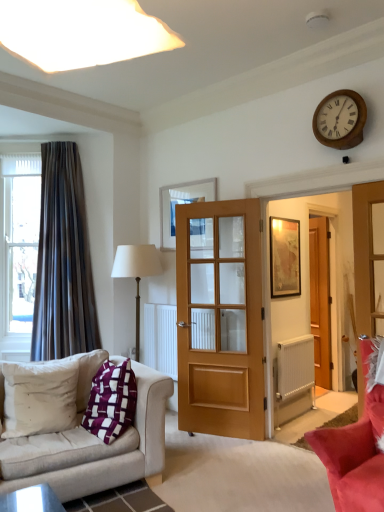
Question: Is wooden door at center, which is the second door from left to right, to the left of matte gold picture frame at center-right, which is the 1th picture frame from right to left, from the viewer's perspective?

Choices:
 (A) yes
 (B) no

Answer: (B)

Question: Is wooden door at center, which is the second door from left to right, smaller than matte gold picture frame at center-right, which is the 1th picture frame from right to left?

Choices:
 (A) no
 (B) yes

Answer: (A)

Question: Considering the relative sizes of wooden door at center, the 1th door positioned from the right, and matte gold picture frame at center-right, the 2th picture frame from the left, in the image provided, is wooden door at center, the 1th door positioned from the right, wider than matte gold picture frame at center-right, the 2th picture frame from the left,?

Choices:
 (A) yes
 (B) no

Answer: (A)

Question: From a real-world perspective, does wooden door at center, the second door viewed from the front, stand above matte gold picture frame at center-right, the 2th picture frame from the left?

Choices:
 (A) yes
 (B) no

Answer: (B)

Question: From a real-world perspective, is wooden door at center, the 1th door from the back, beneath matte gold picture frame at center-right, which is the 1th picture frame from right to left?

Choices:
 (A) no
 (B) yes

Answer: (B)

Question: Is white textured radiator at lower right taller or shorter than white soft cushion at lower left, arranged as the 2th pillow when viewed from the right?

Choices:
 (A) tall
 (B) short

Answer: (B)

Question: Relative to white soft cushion at lower left, the 1th pillow from the left, is white textured radiator at lower right in front or behind?

Choices:
 (A) front
 (B) behind

Answer: (B)

Question: From the image's perspective, relative to white soft cushion at lower left, arranged as the 2th pillow when viewed from the right, is white textured radiator at lower right above or below?

Choices:
 (A) above
 (B) below

Answer: (B)

Question: Is white textured radiator at lower right situated inside white soft cushion at lower left, arranged as the 2th pillow when viewed from the right, or outside?

Choices:
 (A) outside
 (B) inside

Answer: (A)

Question: Considering the positions of point (329, 124) and point (322, 303), is point (329, 124) closer or farther from the camera than point (322, 303)?

Choices:
 (A) farther
 (B) closer

Answer: (B)

Question: Is wooden wall clock at upper right situated inside wooden door at center, the second door viewed from the front, or outside?

Choices:
 (A) outside
 (B) inside

Answer: (A)

Question: From the image's perspective, is wooden wall clock at upper right located above or below wooden door at center, which is the second door from left to right?

Choices:
 (A) above
 (B) below

Answer: (A)

Question: Considering the positions of wooden wall clock at upper right and wooden door at center, the second door viewed from the front, in the image, is wooden wall clock at upper right taller or shorter than wooden door at center, the second door viewed from the front,?

Choices:
 (A) short
 (B) tall

Answer: (A)

Question: Is purple fabric pillow at lower left, the 2th pillow viewed from the left, taller or shorter than white textured radiator at lower right?

Choices:
 (A) short
 (B) tall

Answer: (B)

Question: From a real-world perspective, is purple fabric pillow at lower left, positioned as the 1th pillow in right-to-left order, positioned above or below white textured radiator at lower right?

Choices:
 (A) above
 (B) below

Answer: (A)